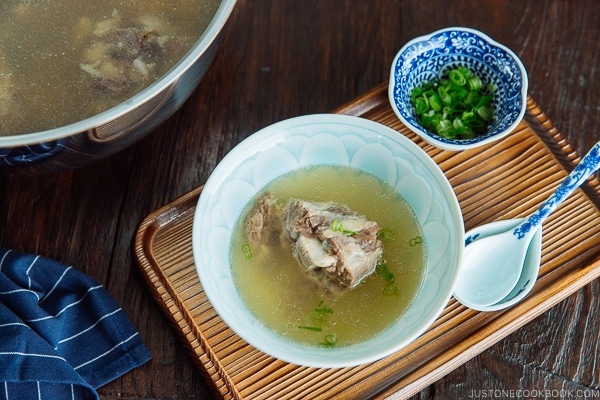
Locate an element on the screen. The width and height of the screenshot is (600, 400). white bowl is located at coordinates (440, 256).